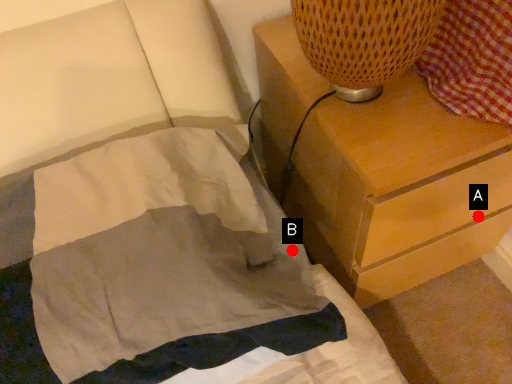
Question: Two points are circled on the image, labeled by A and B beside each circle. Which point is farther to the camera?

Choices:
 (A) A is further
 (B) B is further

Answer: (A)